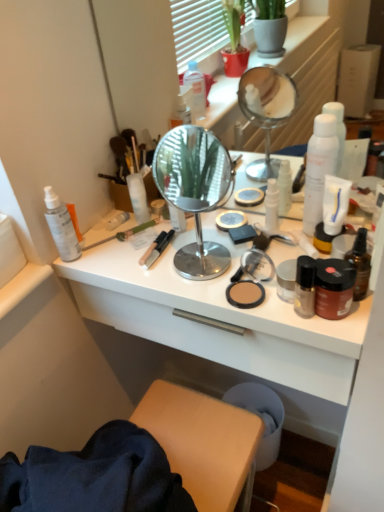
In order to click on vacant space in between translucent plastic spray bottle at left, the 1th toiletry when ordered from left to right, and brown matte jar at right, the second toiletry viewed from the right in this screenshot , I will do `click(163, 276)`.